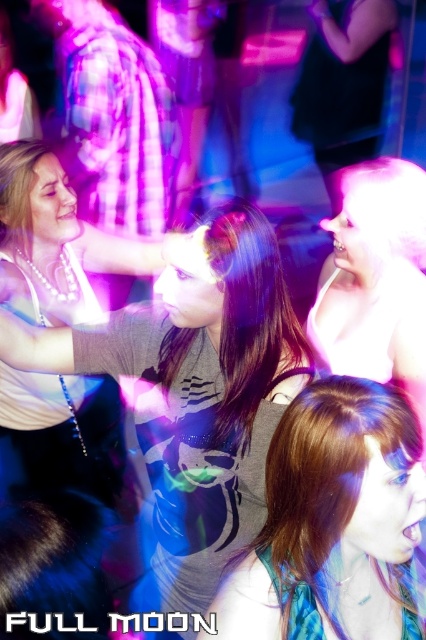
Which is more to the left, matte gray shirt at center or shiny brown hair at center?

From the viewer's perspective, matte gray shirt at center appears more on the left side.

This screenshot has height=640, width=426. What do you see at coordinates (195, 392) in the screenshot?
I see `matte gray shirt at center` at bounding box center [195, 392].

This screenshot has width=426, height=640. Identify the location of matte gray shirt at center. (195, 392).

Who is lower down, matte gray shirt at center or shiny white hair at upper right?

matte gray shirt at center is lower down.

Is matte gray shirt at center to the right of shiny white hair at upper right from the viewer's perspective?

In fact, matte gray shirt at center is to the left of shiny white hair at upper right.

Who is more forward, (276, 305) or (365, 372)?

Positioned in front is point (276, 305).

You are a GUI agent. You are given a task and a screenshot of the screen. Output one action in this format:
    pyautogui.click(x=<x>, y=<y>)
    Task: Click on the matte gray shirt at center
    The width and height of the screenshot is (426, 640).
    Given the screenshot: What is the action you would take?
    pyautogui.click(x=195, y=392)

Can you confirm if shiny brown hair at center is positioned below shiny white hair at upper right?

Correct, shiny brown hair at center is located below shiny white hair at upper right.

Is shiny brown hair at center positioned before shiny white hair at upper right?

Yes.

Measure the distance between shiny brown hair at center and camera.

They are 35.00 inches apart.

Find the location of `shiny brown hair at center`. shiny brown hair at center is located at coordinates (333, 522).